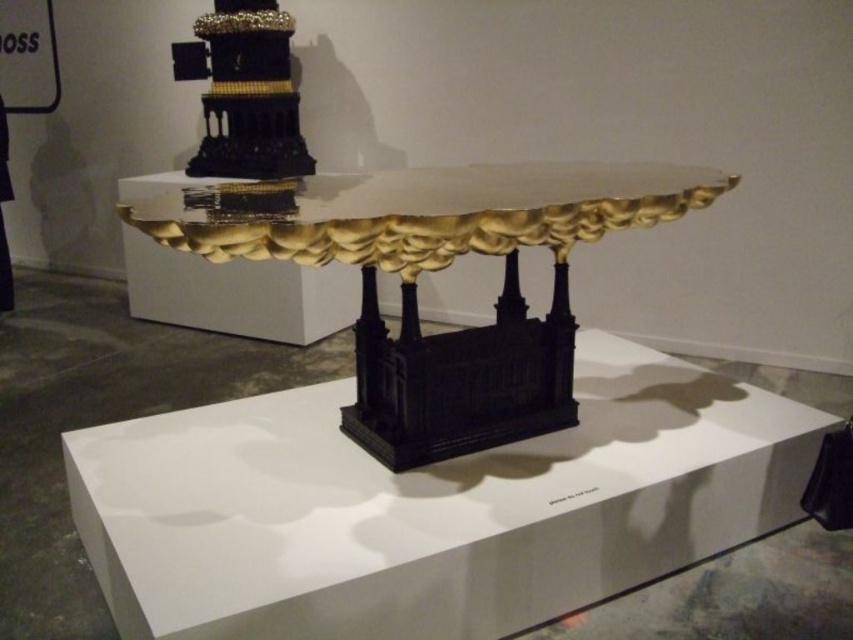
You are an art curator planning to install a new spotlight directly above the black glossy table at center. The spotlight has a circular beam with a radius of 0.3 meters. Given the table is at coordinates point 0.794, 0.504, will the spotlight illuminate the entire table?

The black glossy table at center is located at point (428,508). Since the spotlight has a radius of 0.3 meters, it will cover an area around those coordinates. However, without knowing the table dimensions, we can only confirm the center is illuminated. The entire table might not be fully lit if it extends beyond the beam radius.

Based on the photo, you are an art critic standing in front of the pedestal. You want to take a photo of both the black glossy table at center and the gold textured tower at upper center. Which object should you focus on first to ensure both are in clear view?

You should focus on the black glossy table at center first since it is closer to you than the gold textured tower at upper center, ensuring both are in clear view by starting with the closer object.